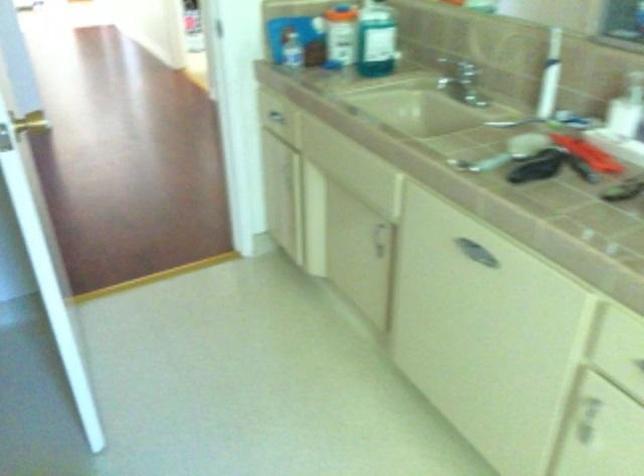
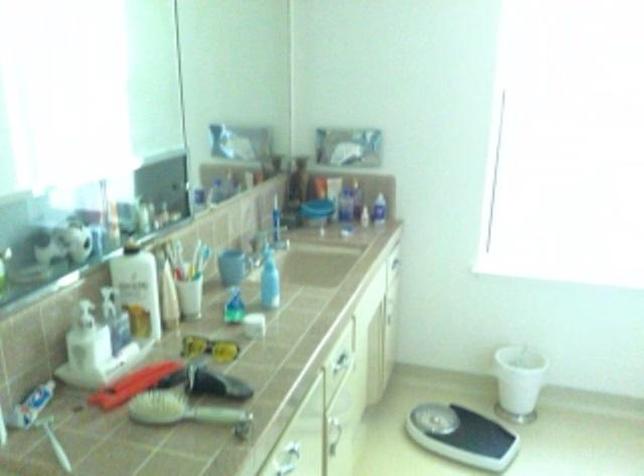
Locate, in the second image, the point that corresponds to [513,292] in the first image.

(290, 455)